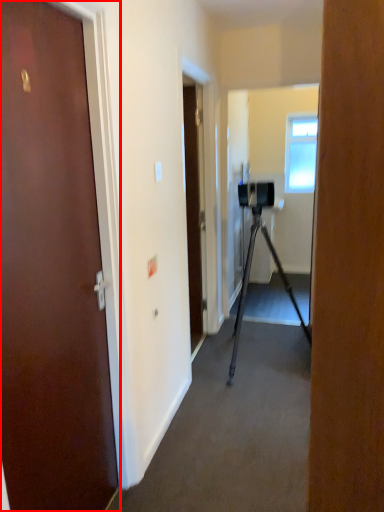
Question: From the image's perspective, considering the relative positions of door (annotated by the red box) and window in the image provided, where is door (annotated by the red box) located with respect to the staircase?

Choices:
 (A) above
 (B) below

Answer: (B)